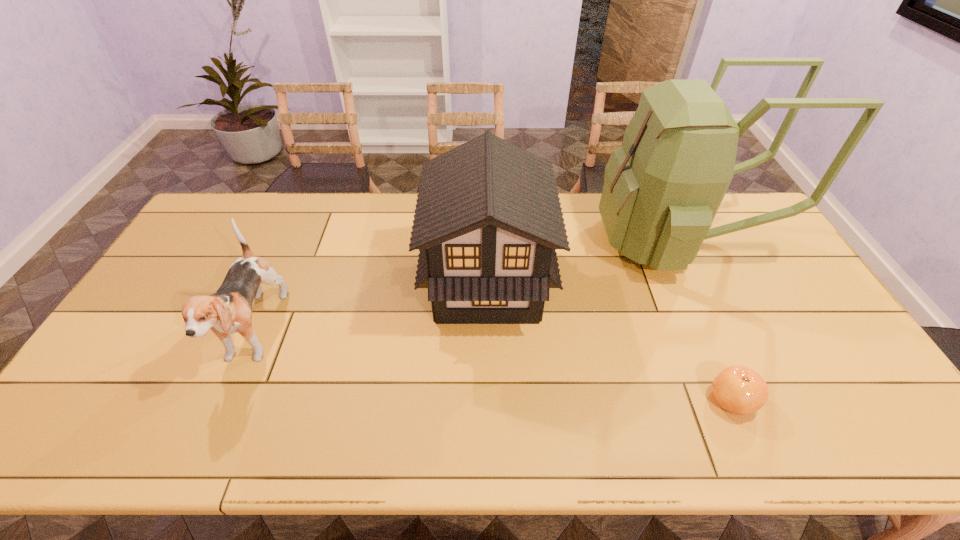
The height and width of the screenshot is (540, 960). Find the location of `the tallest object`. the tallest object is located at coordinates (662, 188).

The image size is (960, 540). Find the location of `the third object from right to left`. the third object from right to left is located at coordinates (488, 220).

You are a GUI agent. You are given a task and a screenshot of the screen. Output one action in this format:
    pyautogui.click(x=<x>, y=<y>)
    Task: Click on the dollhouse
    The image size is (960, 540).
    Given the screenshot: What is the action you would take?
    pyautogui.click(x=488, y=220)

Find the location of a particular element. the leftmost object is located at coordinates (229, 310).

I want to click on the third tallest object, so click(229, 310).

At what (x,y) coordinates should I click in order to perform the action: click on clementine. Please return your answer as a coordinate pair (x, y). Looking at the image, I should click on (740, 390).

Where is `free spot located 0.140m on the front pocket of the tallest object`? free spot located 0.140m on the front pocket of the tallest object is located at coordinates (557, 240).

Image resolution: width=960 pixels, height=540 pixels. What are the coordinates of `blank space located 0.240m on the front pocket of the tallest object` in the screenshot? It's located at (527, 240).

Locate an element on the screen. The height and width of the screenshot is (540, 960). vacant space located 0.230m on the front pocket of the tallest object is located at coordinates (530, 240).

Find the location of `vacant area situated 0.300m on the front-facing side of the second tallest object`. vacant area situated 0.300m on the front-facing side of the second tallest object is located at coordinates (325, 284).